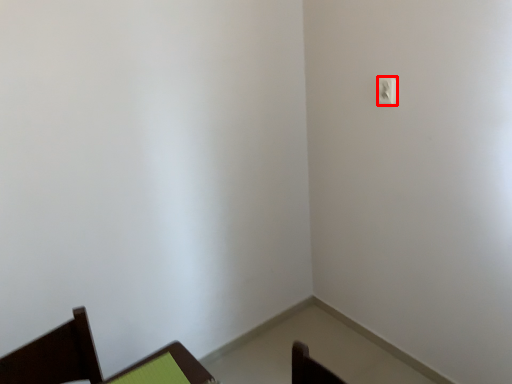
Question: Where is light switch (annotated by the red box) located in relation to furniture in the image?

Choices:
 (A) right
 (B) left

Answer: (A)